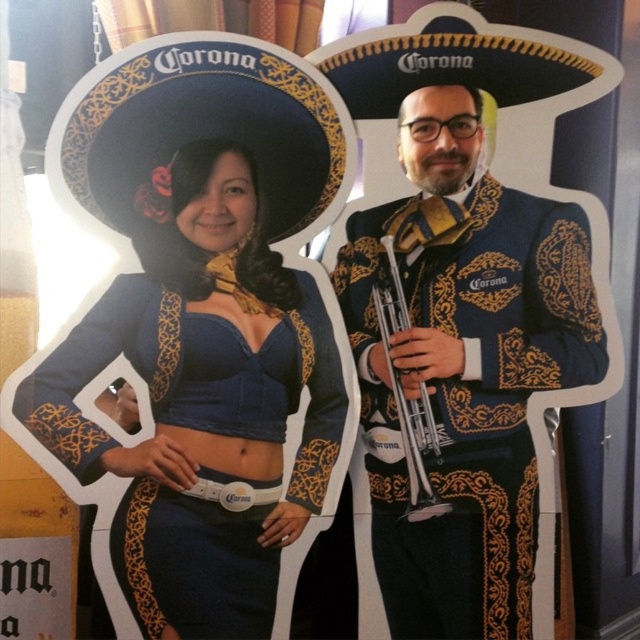
Question: Which object is positioned closest to the matte gold trumpet at center?

Choices:
 (A) matte blue fabric dress at center
 (B) matte black sombrero at upper left

Answer: (A)

Question: Is matte blue fabric dress at center smaller than silver metallic trumpet at center?

Choices:
 (A) yes
 (B) no

Answer: (B)

Question: Which of these objects is positioned closest to the matte black sombrero at upper left?

Choices:
 (A) matte blue fabric dress at center
 (B) silver metallic trumpet at center
 (C) matte gold trumpet at center

Answer: (A)

Question: Which point is closer to the camera?

Choices:
 (A) silver metallic trumpet at center
 (B) matte black sombrero at upper left

Answer: (B)

Question: Can you confirm if matte gold trumpet at center is positioned to the right of silver metallic trumpet at center?

Choices:
 (A) yes
 (B) no

Answer: (A)

Question: Can you confirm if matte blue fabric dress at center is positioned to the left of silver metallic trumpet at center?

Choices:
 (A) yes
 (B) no

Answer: (A)